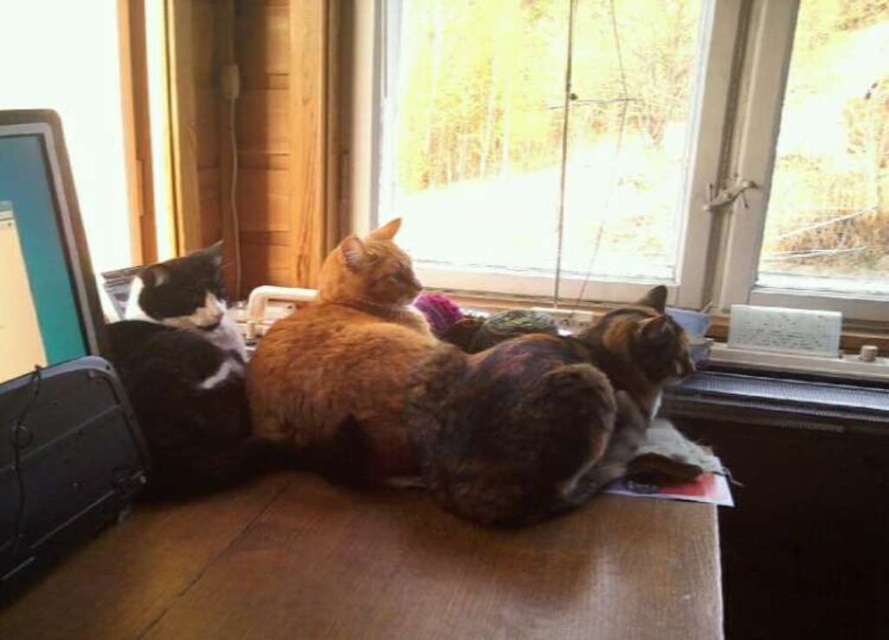
Is brown wooden table at lower center wider than multicolored fur cat at center?

Yes.

Does point (213, 627) lie behind point (549, 365)?

No.

Locate an element on the screen. This screenshot has width=889, height=640. brown wooden table at lower center is located at coordinates (381, 572).

Is the position of brown wooden table at lower center less distant than that of matte black monitor at left?

Yes.

Is brown wooden table at lower center to the right of matte black monitor at left from the viewer's perspective?

Indeed, brown wooden table at lower center is positioned on the right side of matte black monitor at left.

Is point (35, 628) more distant than point (23, 177)?

No, (35, 628) is in front of (23, 177).

Identify the location of brown wooden table at lower center. (381, 572).

Which is above, golden fur cat at center or matte black monitor at left?

matte black monitor at left

Between point (409, 352) and point (75, 228), which one is positioned behind?

Positioned behind is point (409, 352).

What are the coordinates of `golden fur cat at center` in the screenshot? It's located at (346, 365).